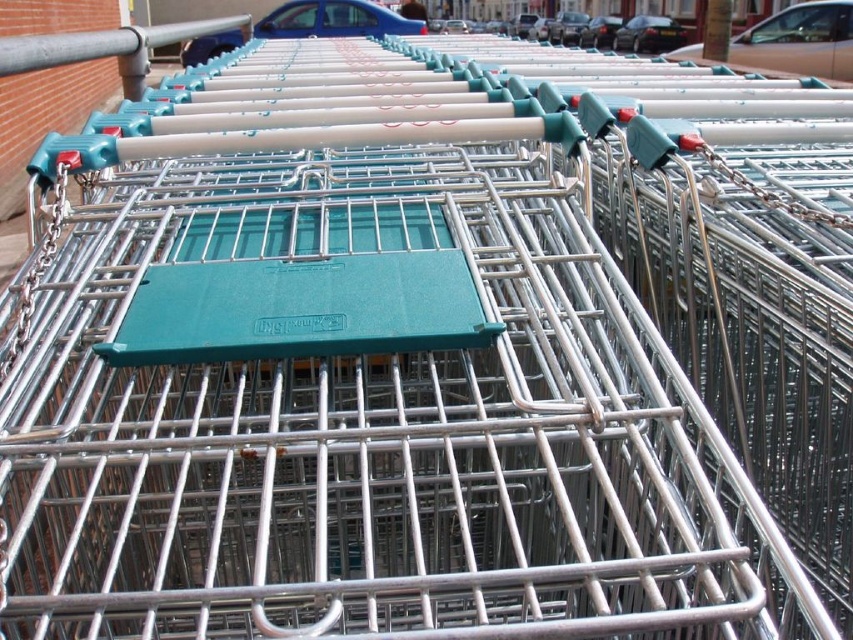
Is point (664, 28) less distant than point (613, 26)?

That is True.

The image size is (853, 640). Describe the element at coordinates (648, 35) in the screenshot. I see `black glossy car at upper center` at that location.

The image size is (853, 640). In order to click on black glossy car at upper center in this screenshot , I will do `click(648, 35)`.

Is brown matte car at upper center wider than black glossy car at center?

Yes, brown matte car at upper center is wider than black glossy car at center.

Does brown matte car at upper center have a smaller size compared to black glossy car at center?

Incorrect, brown matte car at upper center is not smaller in size than black glossy car at center.

Describe the element at coordinates (799, 40) in the screenshot. I see `brown matte car at upper center` at that location.

The image size is (853, 640). In order to click on brown matte car at upper center in this screenshot , I will do `click(799, 40)`.

Does point (374, 4) come behind point (666, 28)?

No, (374, 4) is closer to viewer.

Is blue metallic car at upper center shorter than black glossy car at upper center?

In fact, blue metallic car at upper center may be taller than black glossy car at upper center.

Which is behind, point (207, 38) or point (682, 40)?

The point (682, 40) is behind.

Locate an element on the screen. This screenshot has height=640, width=853. blue metallic car at upper center is located at coordinates (337, 19).